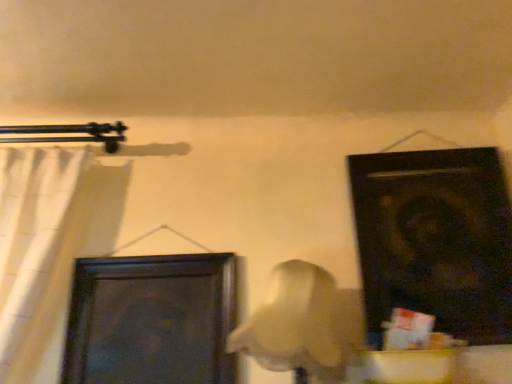
Question: From the image's perspective, is dark wood door at center-left, which is the second door from right to left, on white fabric curtain at left?

Choices:
 (A) no
 (B) yes

Answer: (A)

Question: Is dark wood door at center-left, which is the second door from right to left, smaller than white fabric curtain at left?

Choices:
 (A) yes
 (B) no

Answer: (A)

Question: Is dark wood door at center-left, which is the second door from right to left, positioned with its back to white fabric curtain at left?

Choices:
 (A) yes
 (B) no

Answer: (B)

Question: Is dark wood door at center-left, the first door viewed from the left, far from white fabric curtain at left?

Choices:
 (A) no
 (B) yes

Answer: (A)

Question: Is dark wood door at center-left, which is the second door from right to left, positioned behind white fabric curtain at left?

Choices:
 (A) yes
 (B) no

Answer: (A)

Question: Is dark wood door at center-left, the first door viewed from the left, oriented towards white fabric curtain at left?

Choices:
 (A) yes
 (B) no

Answer: (B)

Question: Is white fabric curtain at left closer to camera compared to black matte door at upper right, the 1th door positioned from the right?

Choices:
 (A) no
 (B) yes

Answer: (B)

Question: Is white fabric curtain at left positioned far away from black matte door at upper right, acting as the 2th door starting from the left?

Choices:
 (A) no
 (B) yes

Answer: (B)

Question: Considering the relative sizes of white fabric curtain at left and black matte door at upper right, acting as the 2th door starting from the left, in the image provided, is white fabric curtain at left wider than black matte door at upper right, acting as the 2th door starting from the left,?

Choices:
 (A) no
 (B) yes

Answer: (B)

Question: From the image's perspective, would you say white fabric curtain at left is positioned over black matte door at upper right, acting as the 2th door starting from the left?

Choices:
 (A) yes
 (B) no

Answer: (B)

Question: From a real-world perspective, is white fabric curtain at left on top of black matte door at upper right, acting as the 2th door starting from the left?

Choices:
 (A) no
 (B) yes

Answer: (A)

Question: Does white fabric curtain at left have a lesser height compared to black matte door at upper right, acting as the 2th door starting from the left?

Choices:
 (A) yes
 (B) no

Answer: (A)

Question: Is dark wood door at center-left, the first door viewed from the left, positioned with its back to black matte door at upper right, acting as the 2th door starting from the left?

Choices:
 (A) no
 (B) yes

Answer: (A)